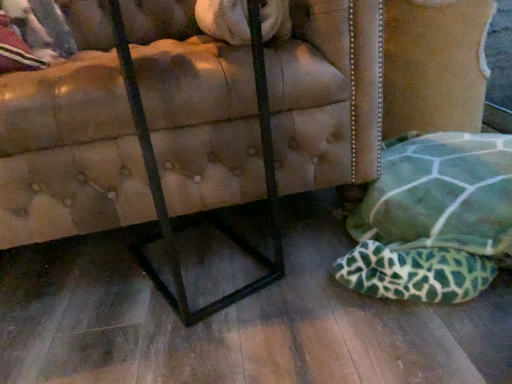
Question: Is leather tufted ottoman at lower right to the left or to the right of green fabric cushion at lower right in the image?

Choices:
 (A) left
 (B) right

Answer: (A)

Question: From their relative heights in the image, would you say leather tufted ottoman at lower right is taller or shorter than green fabric cushion at lower right?

Choices:
 (A) tall
 (B) short

Answer: (A)

Question: Is leather tufted ottoman at lower right spatially inside green fabric cushion at lower right, or outside of it?

Choices:
 (A) outside
 (B) inside

Answer: (A)

Question: Is green fabric cushion at lower right taller or shorter than leather tufted ottoman at lower right?

Choices:
 (A) tall
 (B) short

Answer: (B)

Question: Considering the positions of green fabric cushion at lower right and leather tufted ottoman at lower right in the image, is green fabric cushion at lower right bigger or smaller than leather tufted ottoman at lower right?

Choices:
 (A) small
 (B) big

Answer: (A)

Question: Does point (379, 284) appear closer or farther from the camera than point (220, 173)?

Choices:
 (A) closer
 (B) farther

Answer: (A)

Question: From the image's perspective, is green fabric cushion at lower right above or below leather tufted ottoman at lower right?

Choices:
 (A) below
 (B) above

Answer: (A)